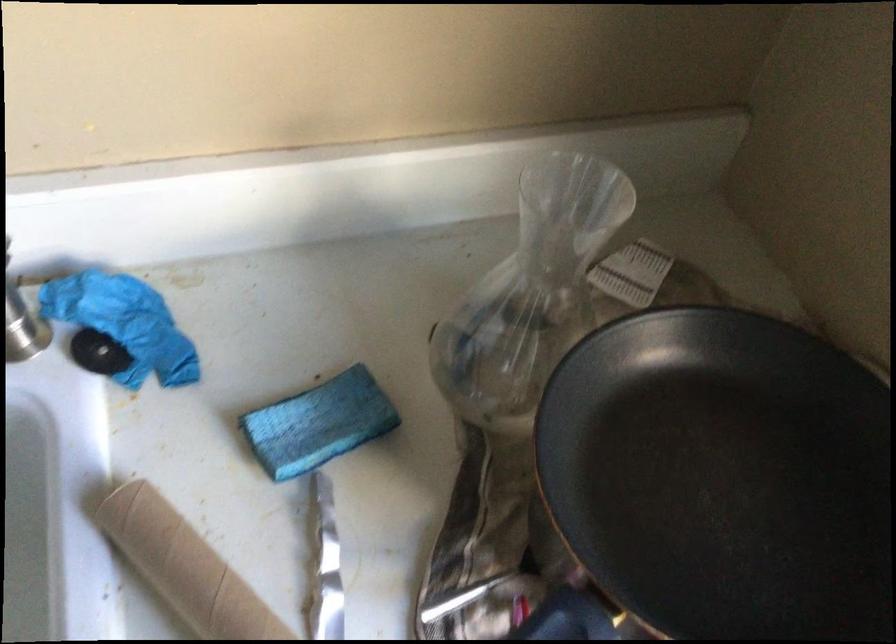
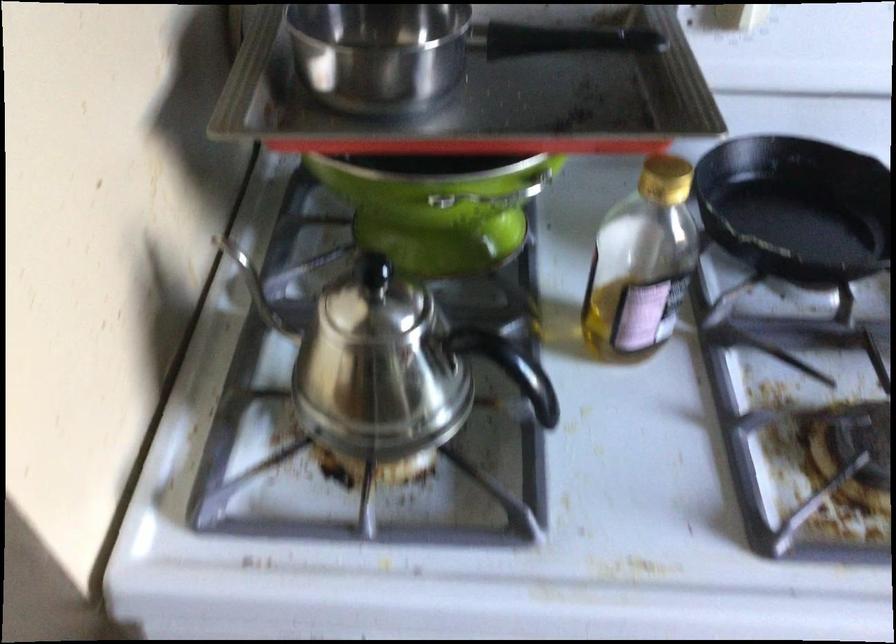
The images are taken continuously from a first-person perspective. In which direction are you moving?

The movement direction of the cameraman is left, backward.